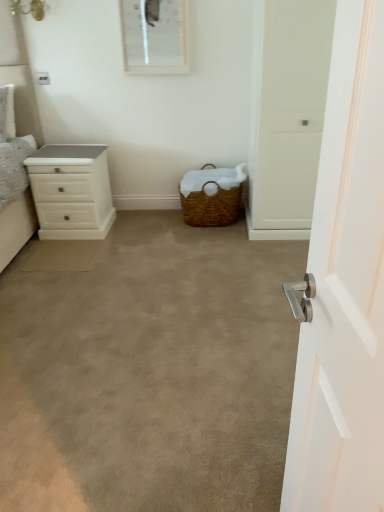
The width and height of the screenshot is (384, 512). Identify the location of vacant space that is in between white glossy chest of drawers at left and woven brown picnic basket at center. (147, 221).